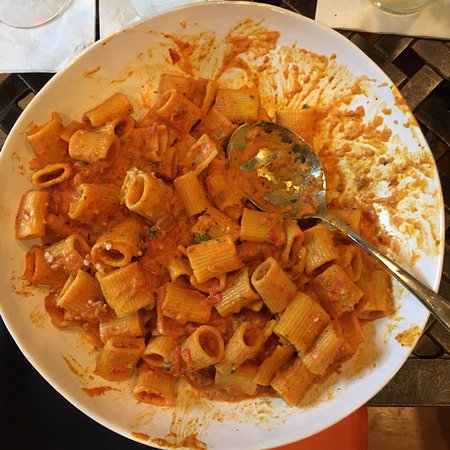
Identify the location of napkin. Image resolution: width=450 pixels, height=450 pixels. (353, 13), (111, 11), (42, 44).